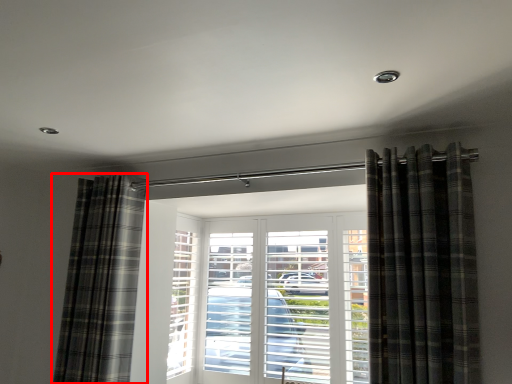
Question: From the image, what is the correct spatial relationship of curtain (annotated by the red box) in relation to curtain?

Choices:
 (A) left
 (B) right

Answer: (A)